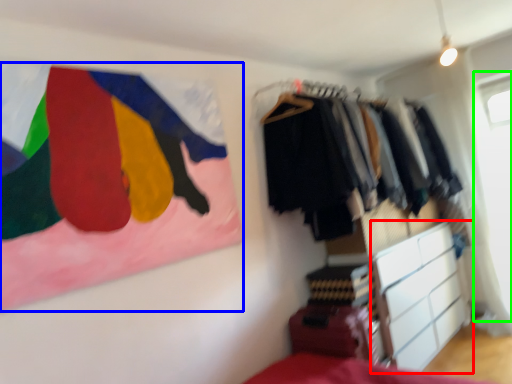
Question: Based on their relative distances, which object is nearer to chest of drawers (highlighted by a red box)? Choose from flag (highlighted by a blue box) and window screen (highlighted by a green box).

Choices:
 (A) flag
 (B) window screen

Answer: (B)